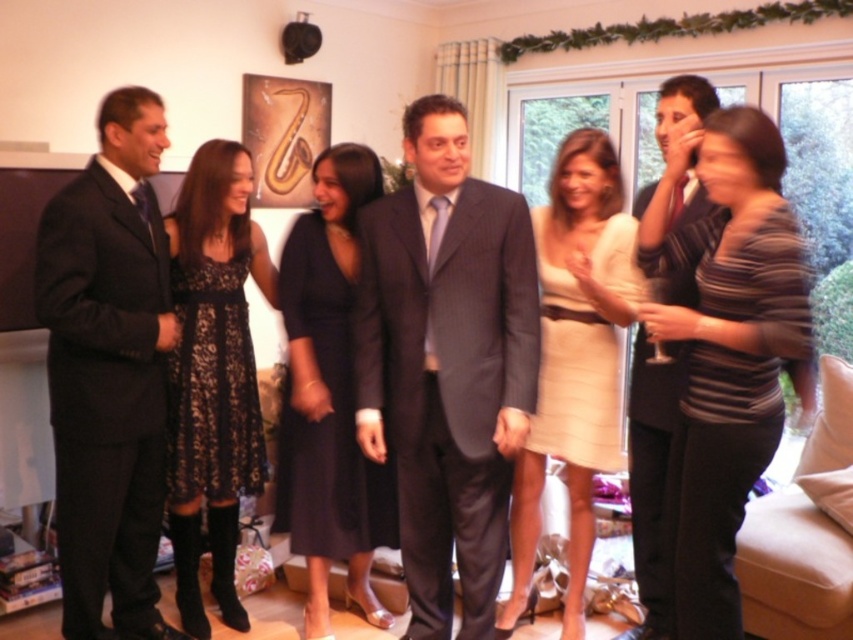
Does black lace dress at center appear over black lace dress at left?

Incorrect, black lace dress at center is not positioned above black lace dress at left.

Is point (238, 284) less distant than point (216, 500)?

Yes.

Identify the location of black lace dress at center. (213, 374).

Does striped fabric dress at right appear on the left side of black lace dress at left?

Incorrect, striped fabric dress at right is not on the left side of black lace dress at left.

Can you confirm if striped fabric dress at right is thinner than black lace dress at left?

No.

Which is in front, point (697, 563) or point (180, 348)?

Positioned in front is point (697, 563).

Image resolution: width=853 pixels, height=640 pixels. What are the coordinates of `striped fabric dress at right` in the screenshot? It's located at (724, 349).

Is matte black suit at left smaller than matte cream dress at center?

Indeed, matte black suit at left has a smaller size compared to matte cream dress at center.

Does matte black suit at left appear over matte cream dress at center?

Correct, matte black suit at left is located above matte cream dress at center.

Image resolution: width=853 pixels, height=640 pixels. What do you see at coordinates (109, 371) in the screenshot?
I see `matte black suit at left` at bounding box center [109, 371].

Find the location of a particular element. The width and height of the screenshot is (853, 640). matte black suit at left is located at coordinates (109, 371).